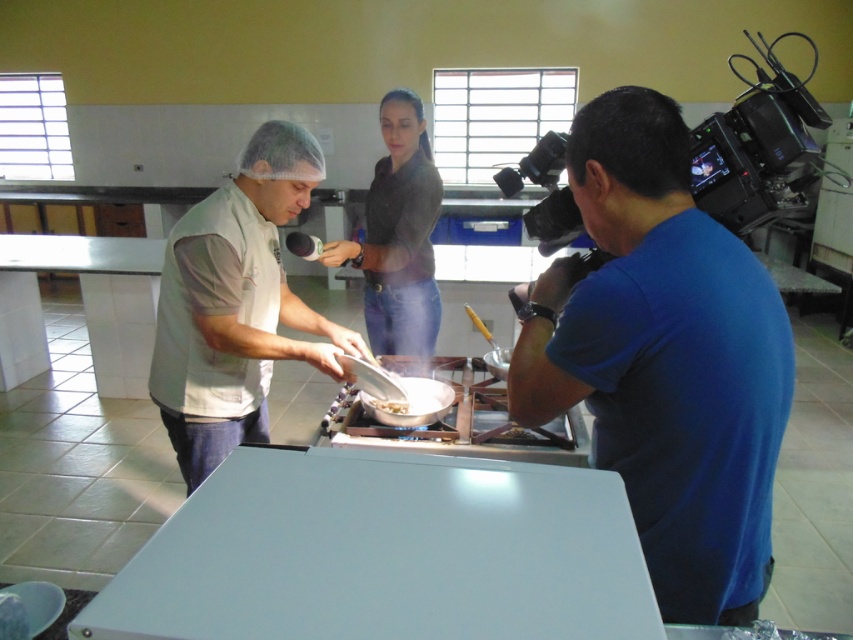
Where is the blue cotton shirt at right located in the image?

The blue cotton shirt at right is located at point 0.561 in the x coordinate and 0.780 in the y coordinate.

You are a chef in a busy kitchen. You need to quickly grab the white glossy pan at center while avoiding the blue cotton shirt at right. Can you reach the pan without moving the shirt?

The blue cotton shirt at right is 27.39 inches away from the white glossy pan at center, so yes, you can reach the pan without moving the shirt since there is enough space between them.

You are standing in the kitchen scene and want to place a 0.8 meter wide cutting board on the smooth matte gray table at center. Based on the table dimensions provided, will it fit?

The smooth matte gray table at center has a width of 0.866 meters according to its coordinates. Since the cutting board is 0.8 meters wide, it will fit comfortably on the table.